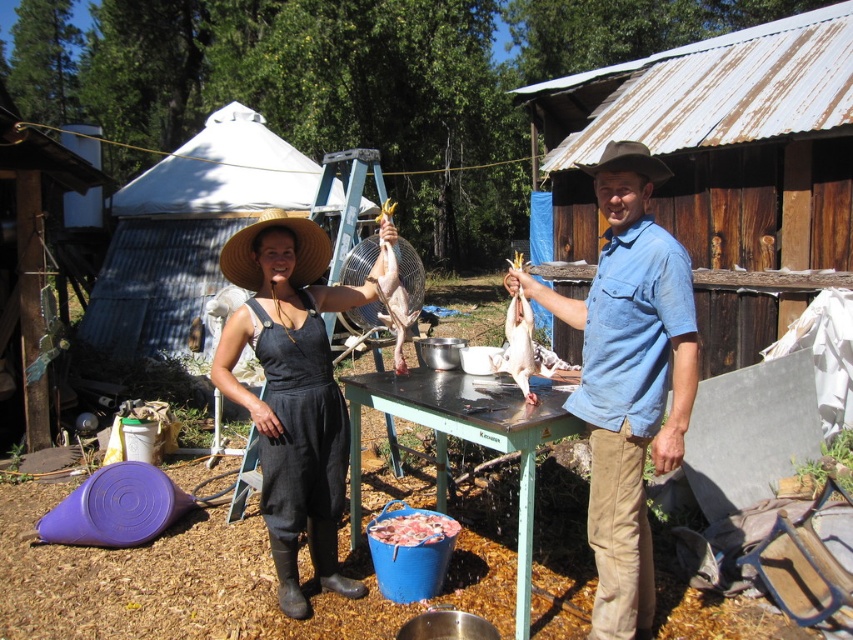
Is blue denim shirt at center closer to camera compared to raw pink meat at center?

Yes, it is in front of raw pink meat at center.

Does point (599, 349) come farther from viewer compared to point (440, 531)?

No, (599, 349) is closer to viewer.

Is point (585, 342) positioned in front of point (448, 516)?

Yes.

You are a GUI agent. You are given a task and a screenshot of the screen. Output one action in this format:
    pyautogui.click(x=<x>, y=<y>)
    Task: Click on the blue denim shirt at center
    The height and width of the screenshot is (640, 853).
    Given the screenshot: What is the action you would take?
    pyautogui.click(x=628, y=390)

Can you confirm if green painted wood table at center is thinner than shiny silver fish at center?

No, green painted wood table at center is not thinner than shiny silver fish at center.

I want to click on green painted wood table at center, so click(465, 438).

Is blue denim shirt at center to the left of smooth skin duck at center from the viewer's perspective?

No, blue denim shirt at center is not to the left of smooth skin duck at center.

Image resolution: width=853 pixels, height=640 pixels. In order to click on blue denim shirt at center in this screenshot , I will do `click(628, 390)`.

The image size is (853, 640). What are the coordinates of `blue denim shirt at center` in the screenshot? It's located at (628, 390).